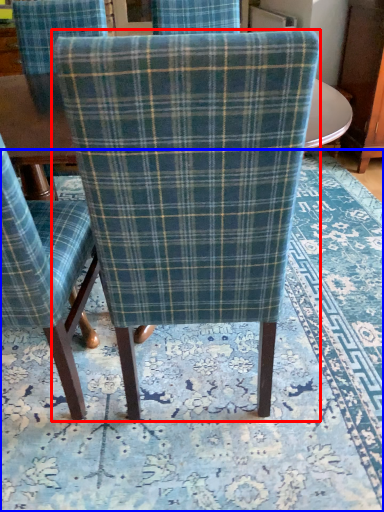
Question: Which point is further to the camera, chair (highlighted by a red box) or mat (highlighted by a blue box)?

Choices:
 (A) chair
 (B) mat

Answer: (B)